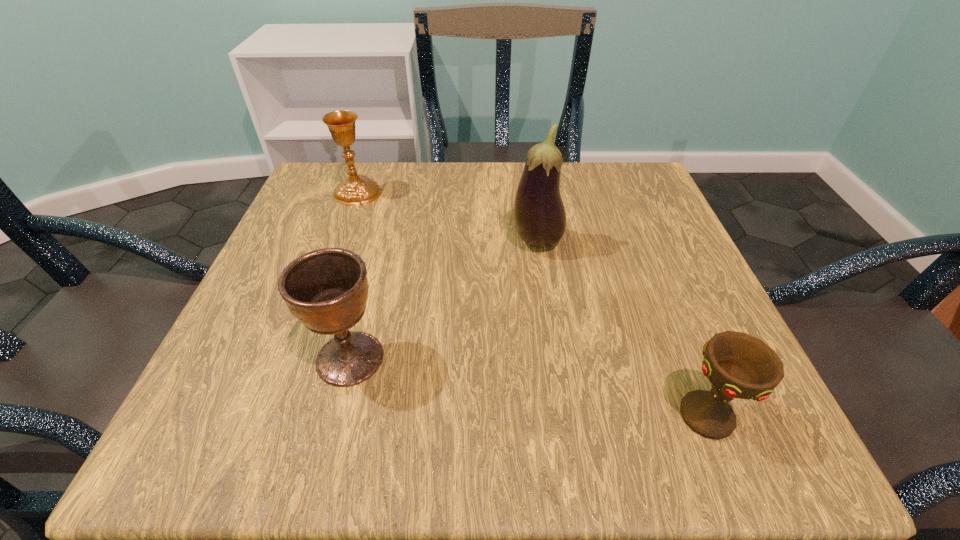
Where is `the second farthest object`? the second farthest object is located at coordinates (540, 219).

Identify the location of the third object from left to right. (540, 219).

Image resolution: width=960 pixels, height=540 pixels. What are the coordinates of `the farthest object` in the screenshot? It's located at (357, 190).

Find the location of `the shortest object`. the shortest object is located at coordinates (x=738, y=365).

Locate an element on the screen. the rightmost chalice is located at coordinates (738, 365).

Where is `free space located on the back of the eggplant`? This screenshot has width=960, height=540. free space located on the back of the eggplant is located at coordinates (530, 194).

Image resolution: width=960 pixels, height=540 pixels. What are the coordinates of `free location located on the back of the farthest chalice` in the screenshot? It's located at (366, 167).

Identify the location of vacant position located 0.190m on the left of the rightmost chalice. click(x=533, y=415).

Where is `object present at the far edge`? object present at the far edge is located at coordinates (357, 190).

Where is `object that is at the near edge`? This screenshot has height=540, width=960. object that is at the near edge is located at coordinates pos(738,365).